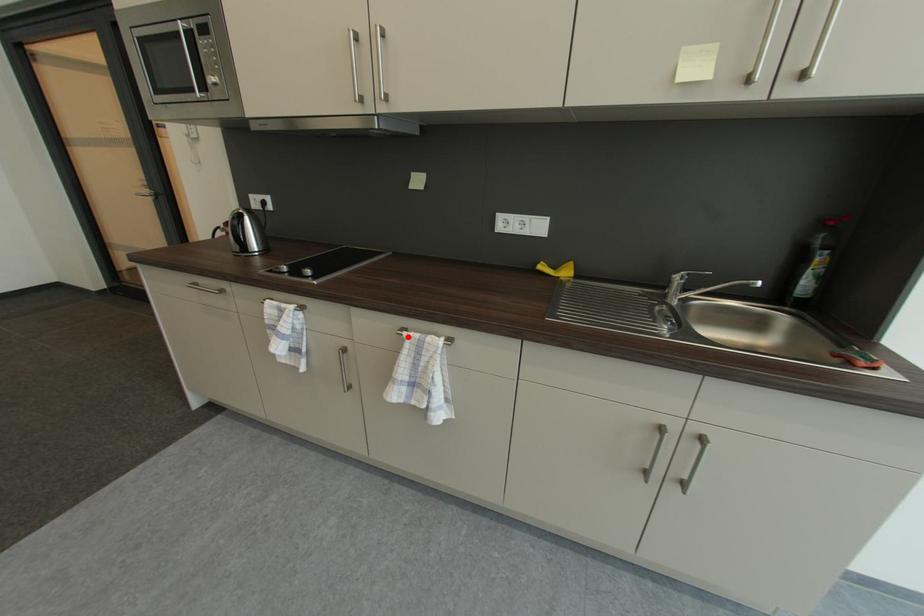
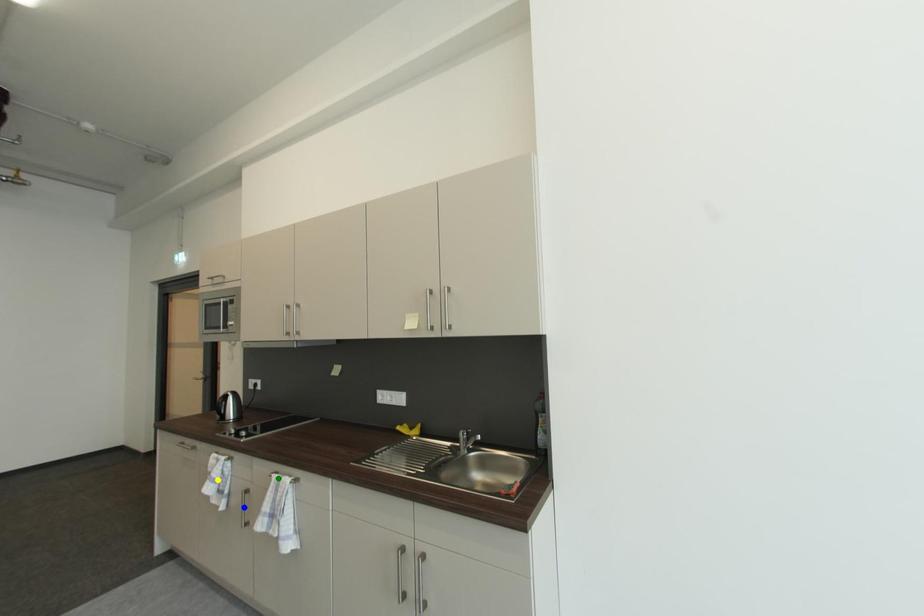
Question: I am providing you with two images of the same scene from different viewpoints. A red point is marked on the first image. You are given multiple points on the second image. Which mark in image 2 goes with the point in image 1?

Choices:
 (A) yellow point
 (B) blue point
 (C) green point

Answer: (C)